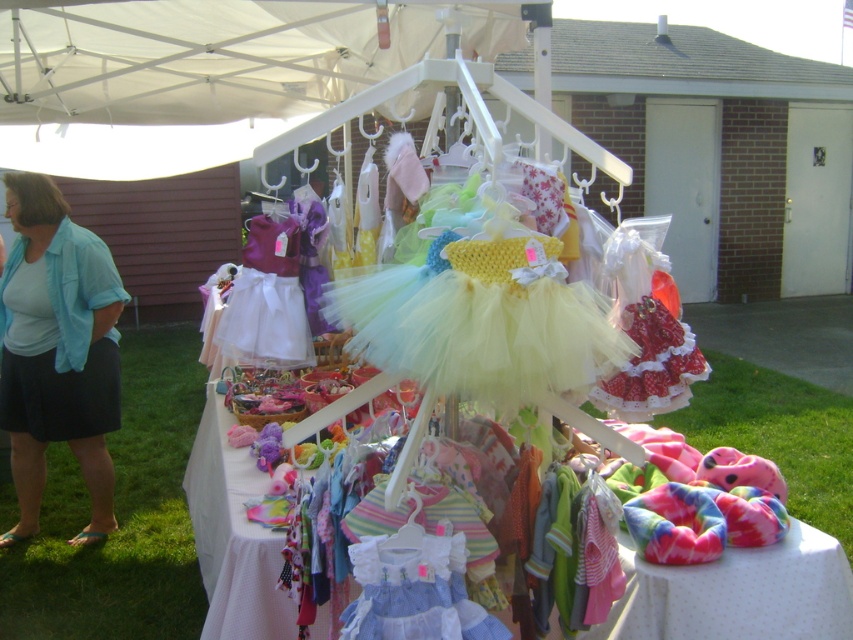
Who is more distant from viewer, (x=500, y=310) or (x=44, y=273)?

Point (x=44, y=273)

Which is more to the left, pastel tulle dress at center or blue cotton shirt at left?

blue cotton shirt at left is more to the left.

Does point (505, 346) lie in front of point (119, 394)?

Yes, point (505, 346) is in front of point (119, 394).

You are a GUI agent. You are given a task and a screenshot of the screen. Output one action in this format:
    pyautogui.click(x=<x>, y=<y>)
    Task: Click on the pastel tulle dress at center
    The height and width of the screenshot is (640, 853).
    Given the screenshot: What is the action you would take?
    pyautogui.click(x=480, y=316)